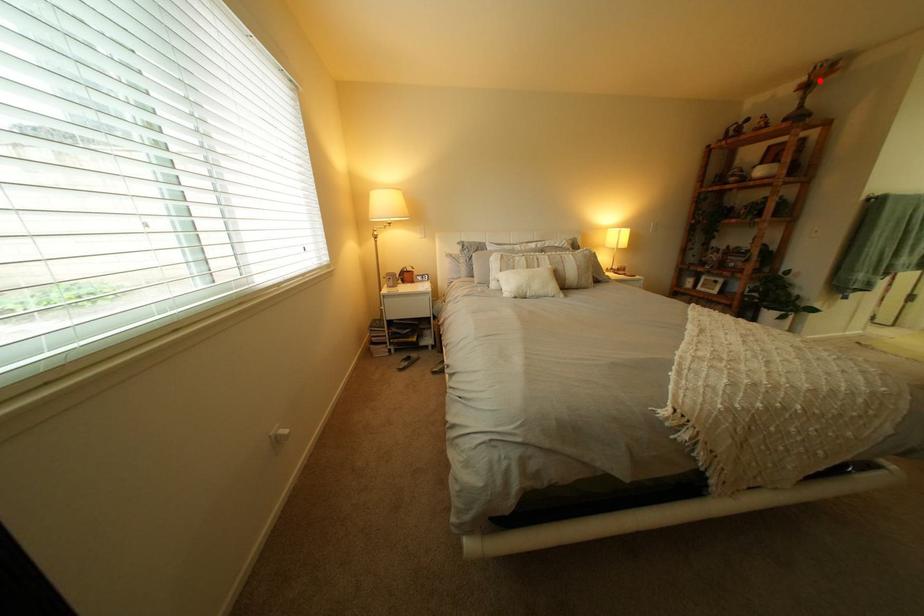
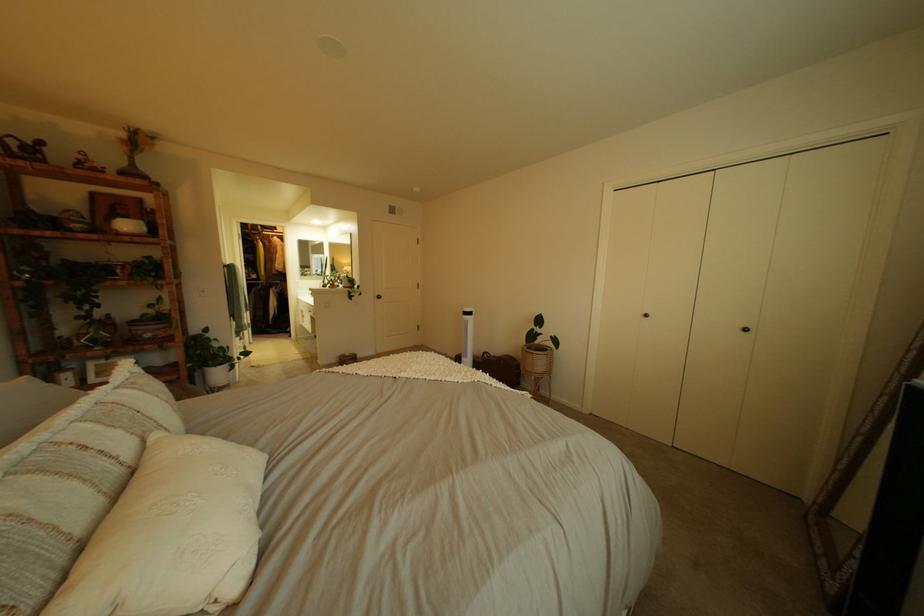
Where in the second image is the point corresponding to the highlighted location from the first image?

(139, 137)